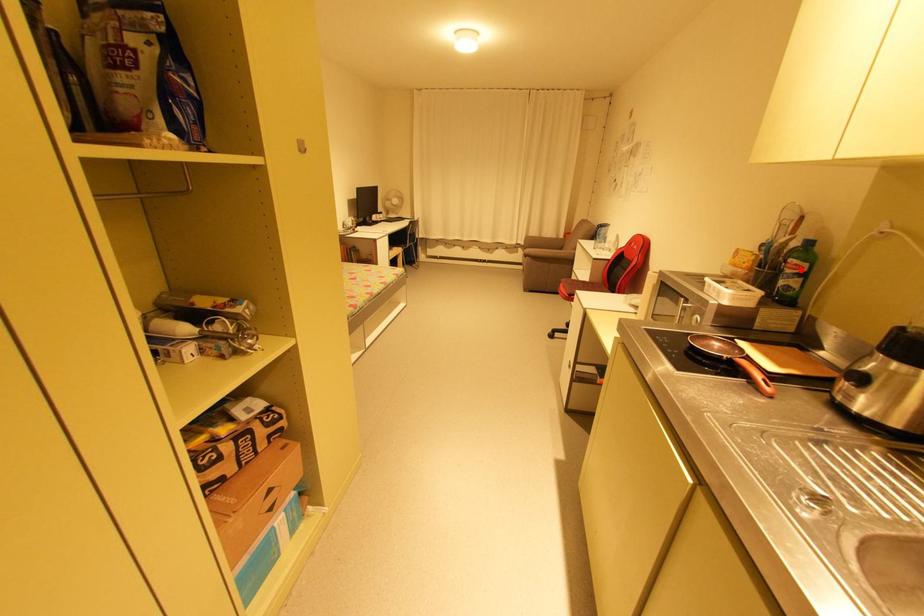
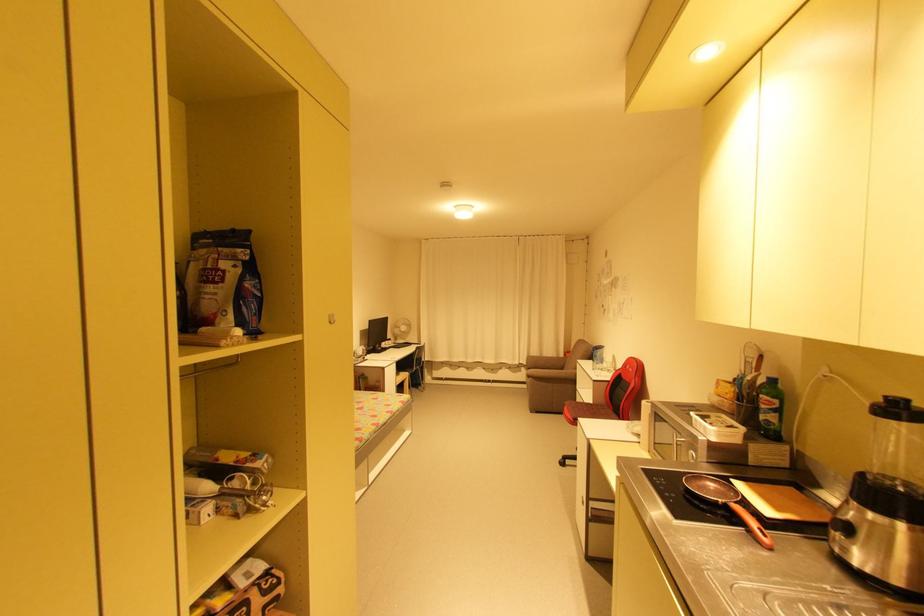
The point at the highlighted location is marked in the first image. Where is the corresponding point in the second image?

(773, 406)